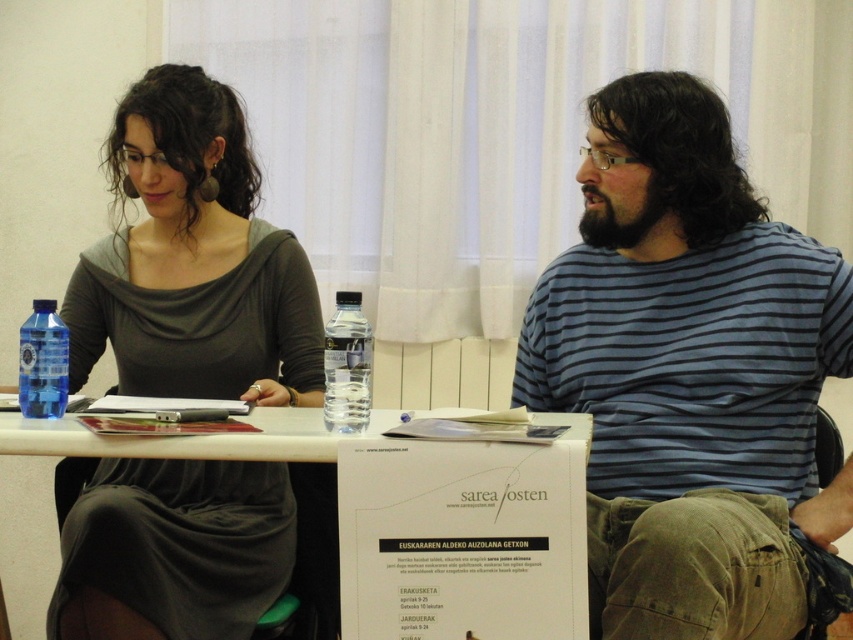
Question: From the image, what is the correct spatial relationship of white paperboard at center in relation to transparent plastic bottle at left?

Choices:
 (A) below
 (B) above

Answer: (A)

Question: Which object is farther from the camera taking this photo?

Choices:
 (A) transparent plastic bottle at left
 (B) white paperboard at center
 (C) matte gray dress at center
 (D) blue striped shirt at center

Answer: (C)

Question: Which point is closer to the camera taking this photo?

Choices:
 (A) (784, 451)
 (B) (112, 156)
 (C) (96, 440)

Answer: (C)

Question: Can you confirm if clear plastic bottle at center is thinner than transparent plastic bottle at left?

Choices:
 (A) yes
 (B) no

Answer: (A)

Question: Does matte gray dress at center have a smaller size compared to clear plastic bottle at center?

Choices:
 (A) yes
 (B) no

Answer: (B)

Question: Which of the following is the farthest from the observer?

Choices:
 (A) (22, 378)
 (B) (592, 394)
 (C) (370, 432)

Answer: (B)